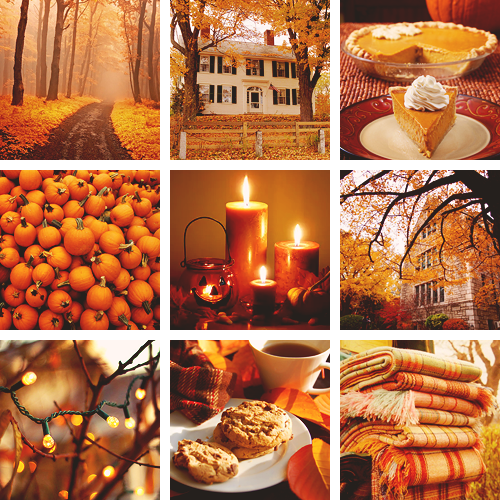
Where is `windows`? Image resolution: width=500 pixels, height=500 pixels. windows is located at coordinates (209, 62), (229, 71), (256, 71), (282, 72), (282, 96), (229, 94), (205, 89), (296, 98), (296, 71).